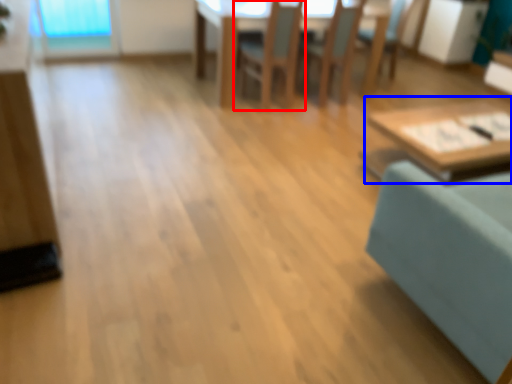
Question: Which of the following is the closest to the observer, chair (highlighted by a red box) or table (highlighted by a blue box)?

Choices:
 (A) chair
 (B) table

Answer: (B)